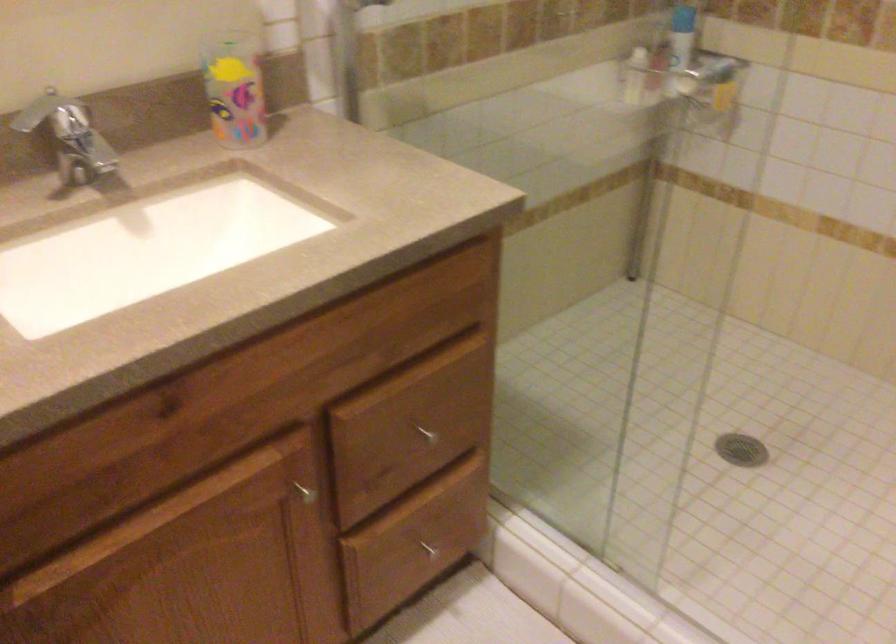
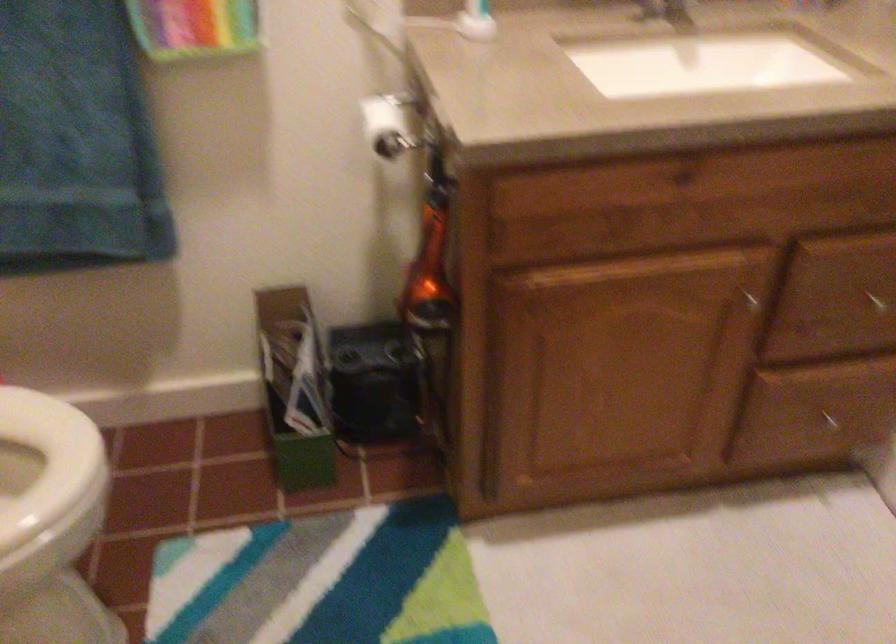
The point at (428, 428) is marked in the first image. Where is the corresponding point in the second image?

(875, 301)